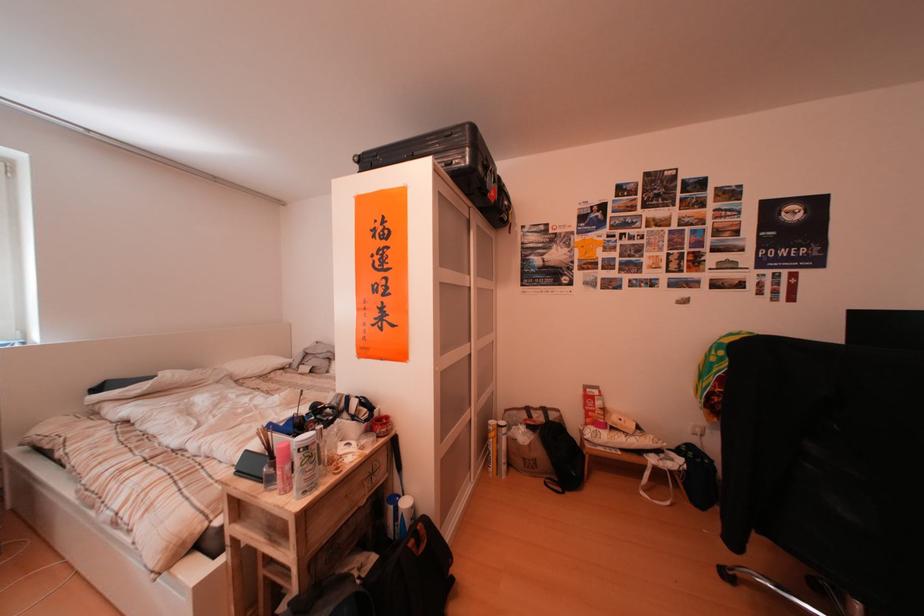
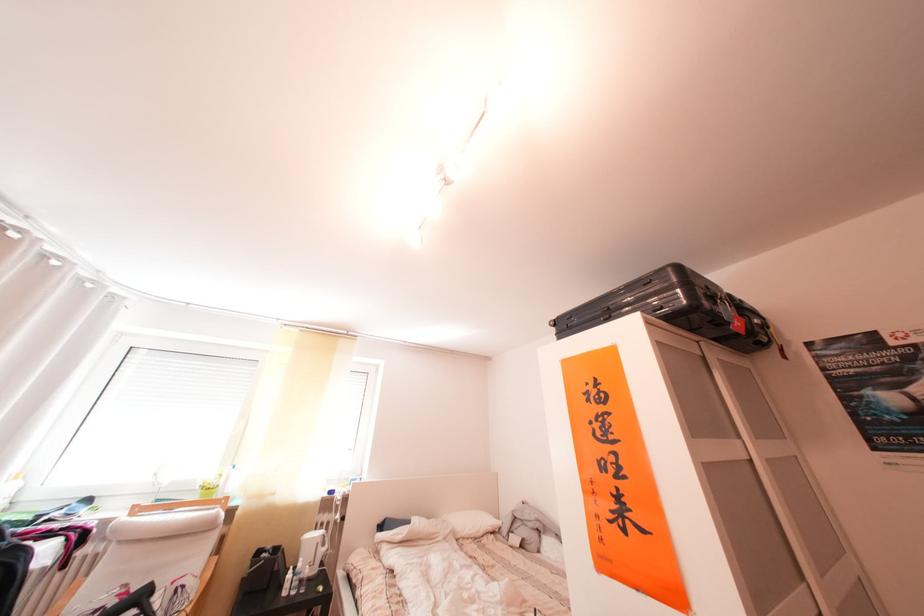
The point at (501,196) is marked in the first image. Where is the corresponding point in the second image?

(742, 329)